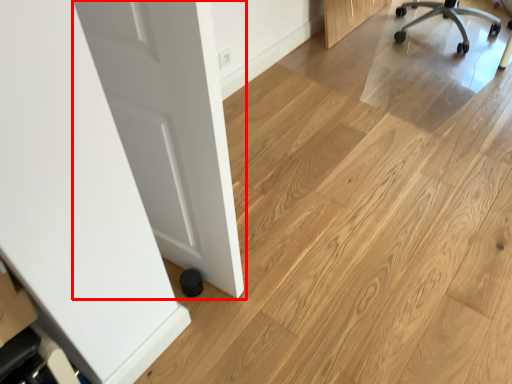
Question: Where is door (annotated by the red box) located in relation to chair in the image?

Choices:
 (A) right
 (B) left

Answer: (B)